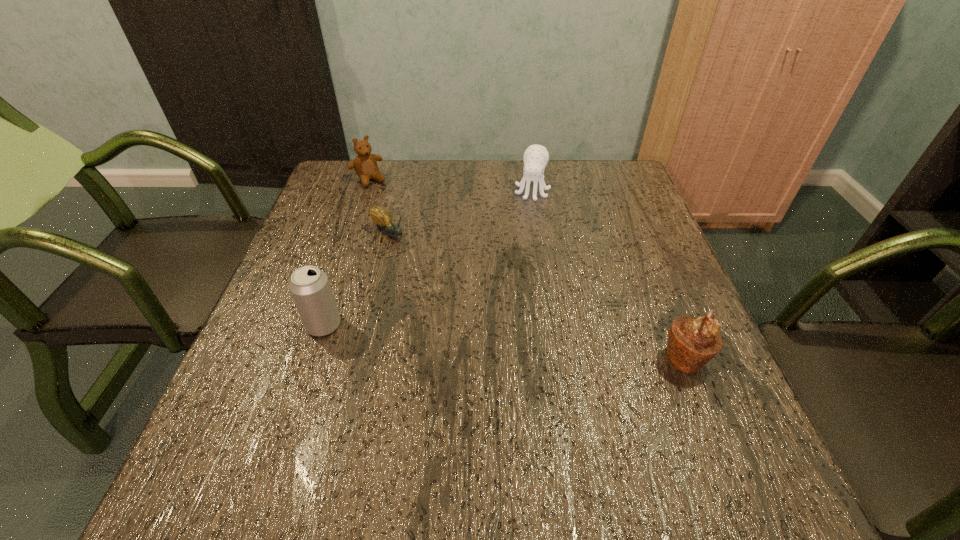
Identify which object is the fourth nearest to the fourth farthest object. Please provide its 2D coordinates. Your answer should be formatted as a tuple, i.e. [(x, y)], where the tuple contains the x and y coordinates of a point satisfying the conditions above.

[(692, 342)]

Locate an element on the screen. Image resolution: width=960 pixels, height=540 pixels. the closest object to the second object from right to left is located at coordinates (381, 216).

This screenshot has height=540, width=960. Find the location of `free spot that satisfies the following two spatial constraints: 1. on the front side of the nearest object; 2. on the left side of the teddy bear`. free spot that satisfies the following two spatial constraints: 1. on the front side of the nearest object; 2. on the left side of the teddy bear is located at coordinates (308, 358).

Locate an element on the screen. The width and height of the screenshot is (960, 540). free spot that satisfies the following two spatial constraints: 1. on the front side of the rightmost object; 2. on the left side of the second nearest object is located at coordinates [x=313, y=358].

Image resolution: width=960 pixels, height=540 pixels. Find the location of `vacant space that satisfies the following two spatial constraints: 1. on the front side of the beer can; 2. on the right side of the muffin`. vacant space that satisfies the following two spatial constraints: 1. on the front side of the beer can; 2. on the right side of the muffin is located at coordinates (313, 358).

Find the location of `blank area in the image that satisfies the following two spatial constraints: 1. on the front side of the rightmost object; 2. on the right side of the teddy bear`. blank area in the image that satisfies the following two spatial constraints: 1. on the front side of the rightmost object; 2. on the right side of the teddy bear is located at coordinates (308, 358).

The image size is (960, 540). I want to click on blank area in the image that satisfies the following two spatial constraints: 1. on the front side of the teddy bear; 2. on the left side of the fourth farthest object, so click(320, 325).